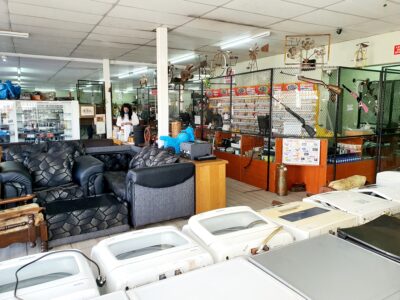
Identify the location of seats. (7, 187), (17, 213), (52, 167), (26, 148), (71, 144), (102, 144), (100, 214), (129, 172).